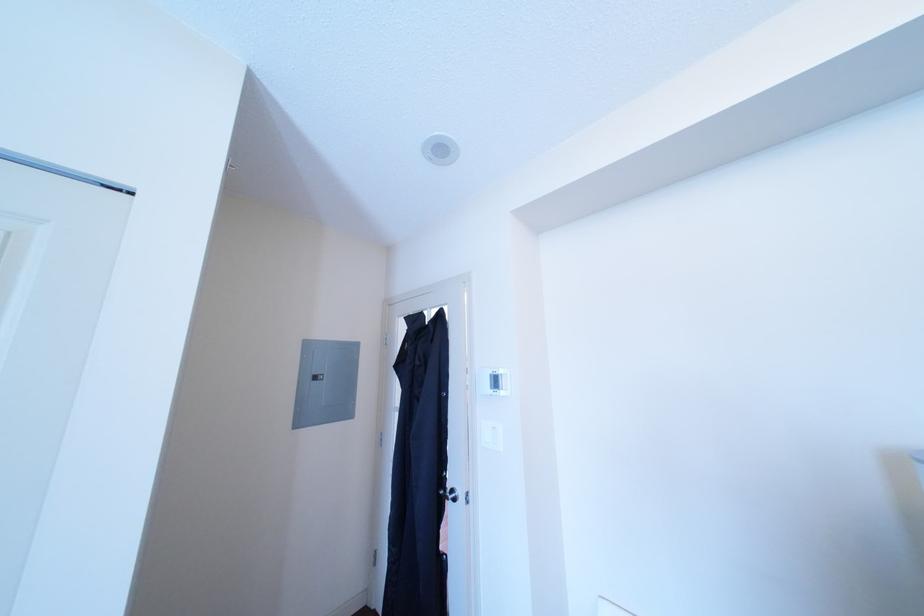
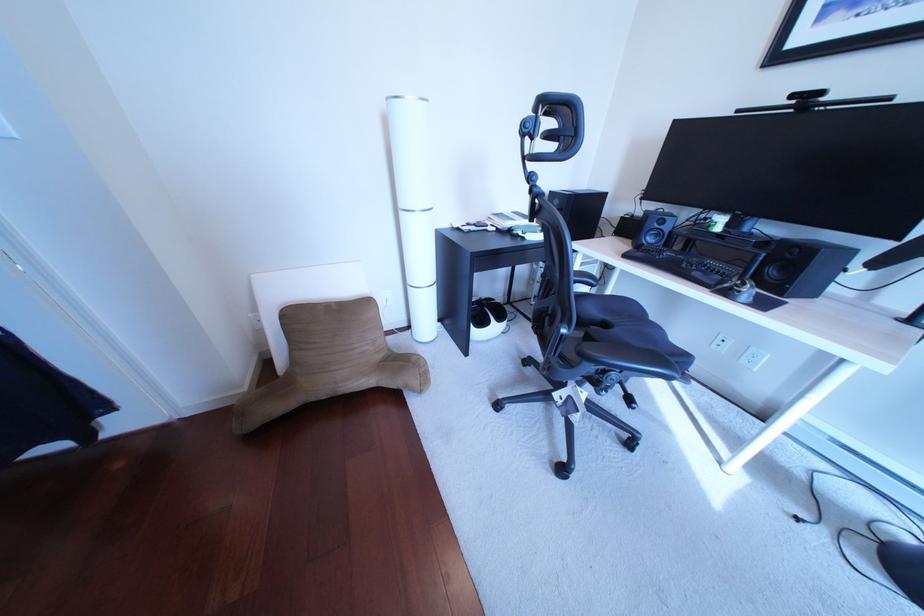
The images are taken continuously from a first-person perspective. In which direction is your viewpoint rotating?

The rotation direction of the camera is right-down.